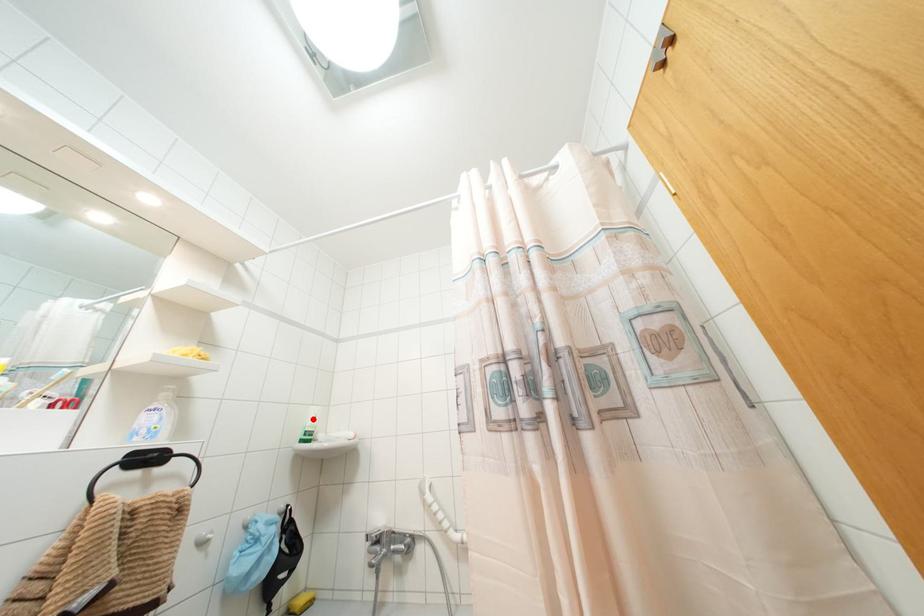
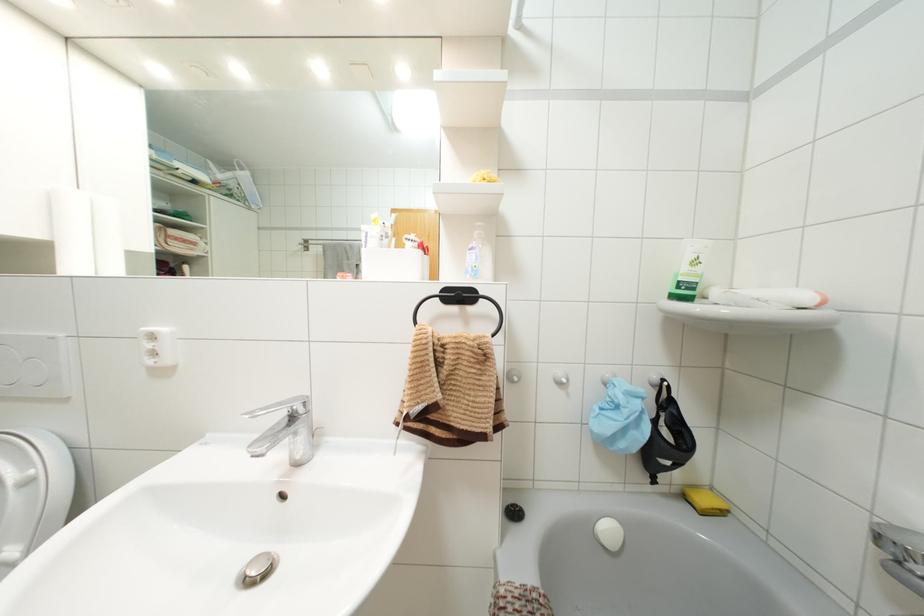
Where in the second image is the point corresponding to the highlighted location from the first image?

(695, 262)